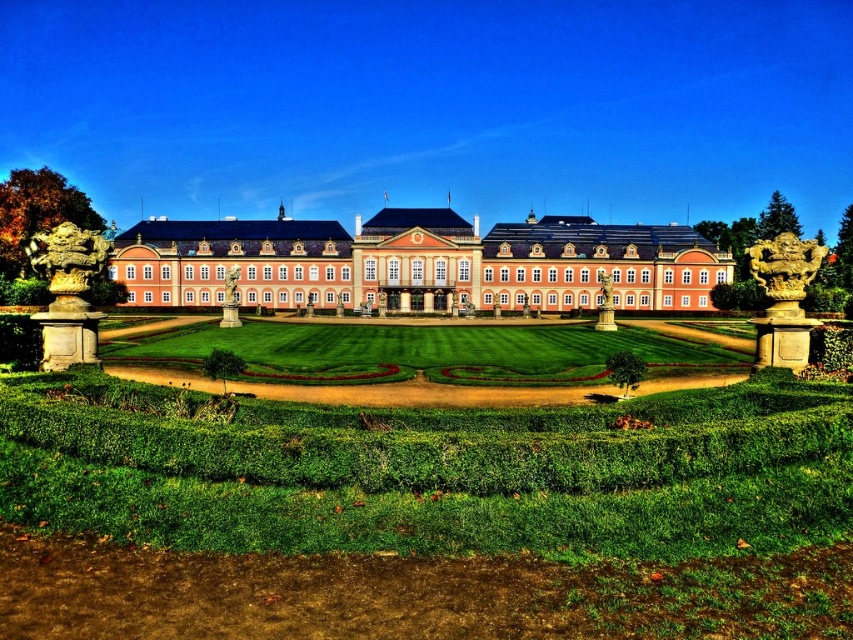
Question: Is matte pink building at center thinner than green leafy hedge at center?

Choices:
 (A) no
 (B) yes

Answer: (A)

Question: Considering the real-world distances, which object is closest to the green grass at center?

Choices:
 (A) matte pink building at center
 (B) green leafy hedge at center

Answer: (A)

Question: Which object is positioned farthest from the matte pink building at center?

Choices:
 (A) green leafy hedge at center
 (B) green grass at center

Answer: (B)

Question: Considering the relative positions of green grass at center and green leafy hedge at center in the image provided, where is green grass at center located with respect to green leafy hedge at center?

Choices:
 (A) below
 (B) above

Answer: (A)

Question: Does green grass at center appear under green leafy hedge at center?

Choices:
 (A) yes
 (B) no

Answer: (A)

Question: Among these objects, which one is nearest to the camera?

Choices:
 (A) green grass at center
 (B) green leafy hedge at center

Answer: (A)